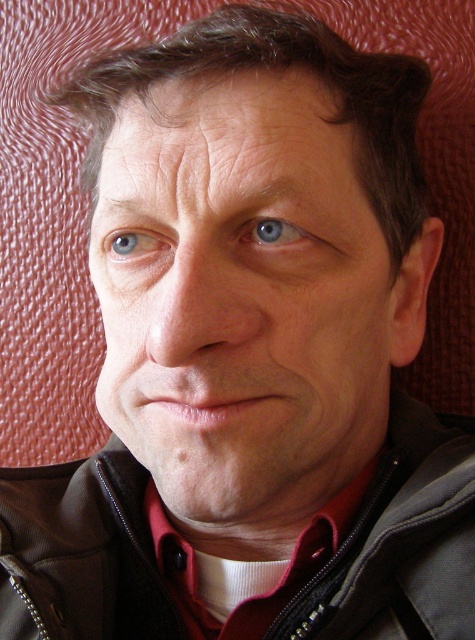
You are a photographer adjusting the focus on your camera. You notice the matte black face at center and the textured red background. Which one is closer to the camera lens?

The matte black face at center is closer to the camera lens since it is in focus while the background is blurred.

You are a photographer using a camera with a focal length of 50mm. You want to take a portrait where the subject fills the frame perfectly without any distortion. Given that the camera sensor size is 36mm x 24mm, what is the minimum distance you should maintain between the camera and the matte black face at center to avoid cropping?

The minimum distance required is calculated using the formula distance > sensor dimension divided by 2 times tan of half the angle of view. For a 50mm lens at 35mm format, the angle of view is approximately 46.8 degrees. Half of that is 23.4 degrees. tan 23.4 is about 0.433. The sensor width is 36mm. So 36 divided by 2 times 0.433 equals 36 divided by 0.866 equals approximately 41.58mm. Converting to centimeters, that is 4.158 cm. However, since the current distance is 27.56 cm, which is much larger than 4.

You are a fashion designer analyzing the image. You need to determine if the dark brown leather jacket at center can be seen above the blue glossy eye at center. Based on the spatial arrangement, what is your conclusion?

The dark brown leather jacket at center is taller than blue glossy eye at center, so yes, the jacket can be seen above the blue glossy eye at center.